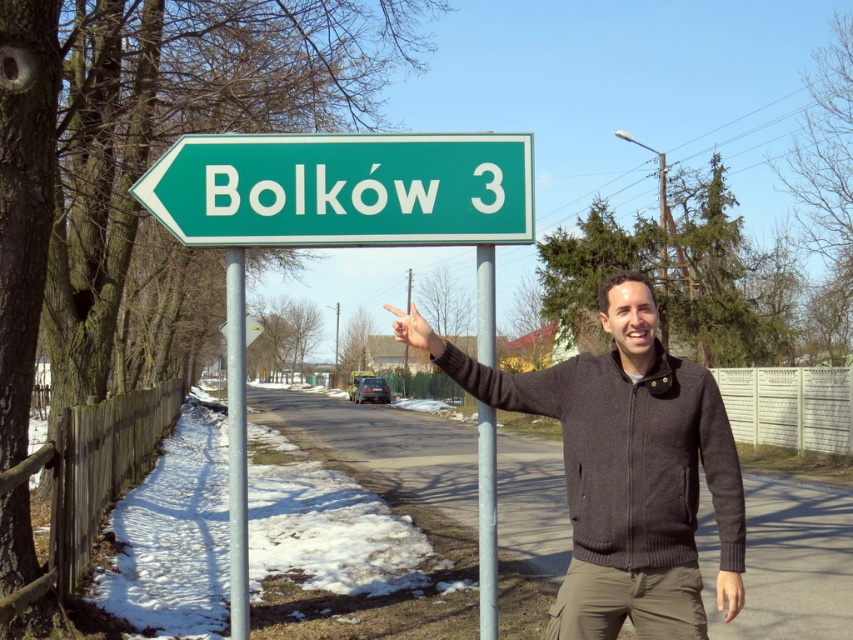
Between green plastic sign at left and metallic pole at left, which one appears on the right side from the viewer's perspective?

From the viewer's perspective, green plastic sign at left appears more on the right side.

Is green plastic sign at left behind metallic pole at left?

No, green plastic sign at left is closer to the viewer.

Is point (181, 230) closer to viewer compared to point (234, 554)?

No, it is behind (234, 554).

This screenshot has height=640, width=853. Find the location of `green plastic sign at left`. green plastic sign at left is located at coordinates (343, 189).

Is dark gray sweater at center positioned in front of green plastic sign at left?

Yes.

The height and width of the screenshot is (640, 853). What do you see at coordinates (625, 468) in the screenshot?
I see `dark gray sweater at center` at bounding box center [625, 468].

Does point (677, 541) come behind point (306, 157)?

No, (677, 541) is closer to viewer.

This screenshot has height=640, width=853. I want to click on dark gray sweater at center, so click(x=625, y=468).

What do you see at coordinates (625, 468) in the screenshot? The width and height of the screenshot is (853, 640). I see `dark gray sweater at center` at bounding box center [625, 468].

Does dark gray sweater at center have a lesser width compared to green plastic sign at upper left?

Yes, dark gray sweater at center is thinner than green plastic sign at upper left.

From the picture: Who is more forward, (709, 461) or (224, 324)?

Point (709, 461)

At what (x,y) coordinates should I click in order to perform the action: click on dark gray sweater at center. Please return your answer as a coordinate pair (x, y). This screenshot has width=853, height=640. Looking at the image, I should click on (625, 468).